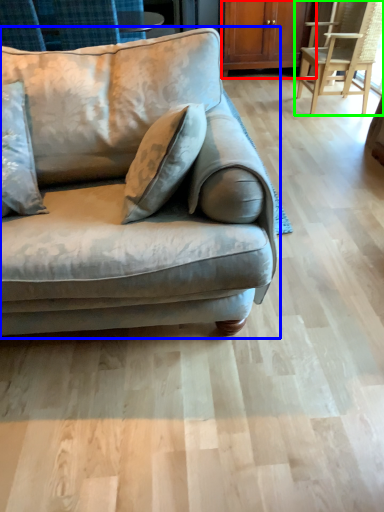
Question: Which object is the closest to the dresser (highlighted by a red box)? Choose among these: studio couch (highlighted by a blue box) or chair (highlighted by a green box).

Choices:
 (A) studio couch
 (B) chair

Answer: (B)